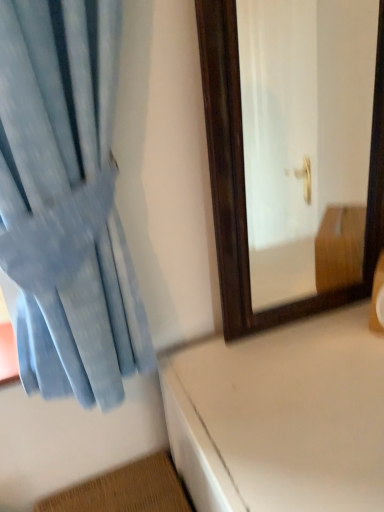
Question: Choose the correct answer: Is white glossy table at lower right inside light blue fabric curtain at left or outside it?

Choices:
 (A) outside
 (B) inside

Answer: (A)

Question: Is white glossy table at lower right taller or shorter than light blue fabric curtain at left?

Choices:
 (A) short
 (B) tall

Answer: (B)

Question: From the image's perspective, relative to light blue fabric curtain at left, is white glossy table at lower right above or below?

Choices:
 (A) below
 (B) above

Answer: (A)

Question: Is light blue fabric curtain at left spatially inside white glossy table at lower right, or outside of it?

Choices:
 (A) inside
 (B) outside

Answer: (B)

Question: Considering their positions, is light blue fabric curtain at left located in front of or behind white glossy table at lower right?

Choices:
 (A) behind
 (B) front

Answer: (B)

Question: Considering the positions of light blue fabric curtain at left and white glossy table at lower right in the image, is light blue fabric curtain at left wider or thinner than white glossy table at lower right?

Choices:
 (A) thin
 (B) wide

Answer: (A)

Question: Is light blue fabric curtain at left bigger or smaller than white glossy table at lower right?

Choices:
 (A) big
 (B) small

Answer: (B)